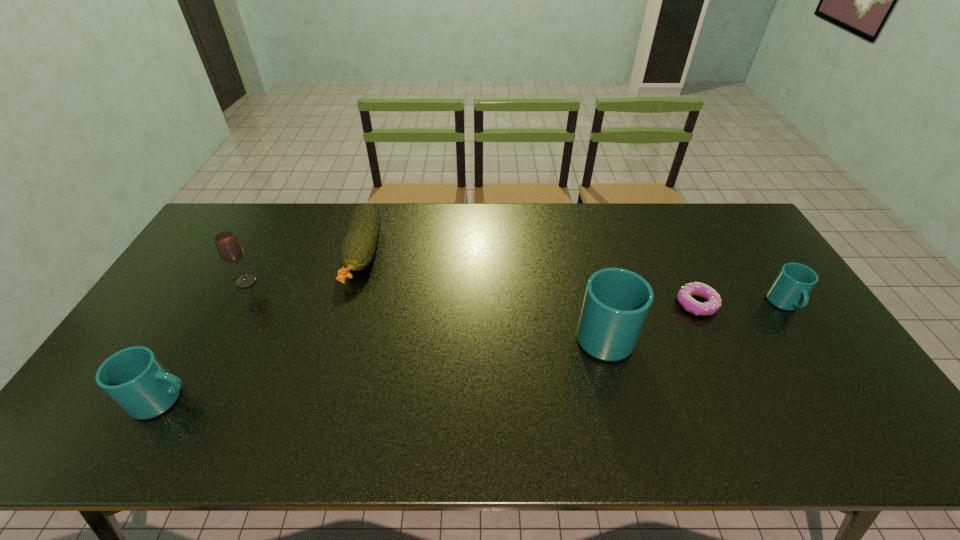
Locate an element on the screen. Image resolution: width=960 pixels, height=540 pixels. object located at the left edge is located at coordinates (135, 378).

Find the location of a particular element. This screenshot has height=540, width=960. object that is at the right edge is located at coordinates (789, 291).

The image size is (960, 540). Identify the location of object that is at the near left corner. (135, 378).

Identify the location of vacant space at the far edge of the desktop. The height and width of the screenshot is (540, 960). (447, 205).

Find the location of a particular element. The height and width of the screenshot is (540, 960). vacant space at the near edge is located at coordinates (643, 377).

Where is `vacant space at the right edge of the desktop`? The height and width of the screenshot is (540, 960). vacant space at the right edge of the desktop is located at coordinates (787, 312).

In the image, there is a desktop. In order to click on vacant space at the far right corner in this screenshot , I will do `click(739, 222)`.

Find the location of a particular element. free space between the second object from right to left and the nearest cup is located at coordinates (430, 352).

The width and height of the screenshot is (960, 540). I want to click on empty space that is in between the nearest object and the cucumber, so pyautogui.click(x=263, y=327).

You are a GUI agent. You are given a task and a screenshot of the screen. Output one action in this format:
    pyautogui.click(x=<x>, y=<y>)
    Task: Click on the free spot between the third object from right to left and the shortest object
    
    Given the screenshot: What is the action you would take?
    pyautogui.click(x=650, y=318)